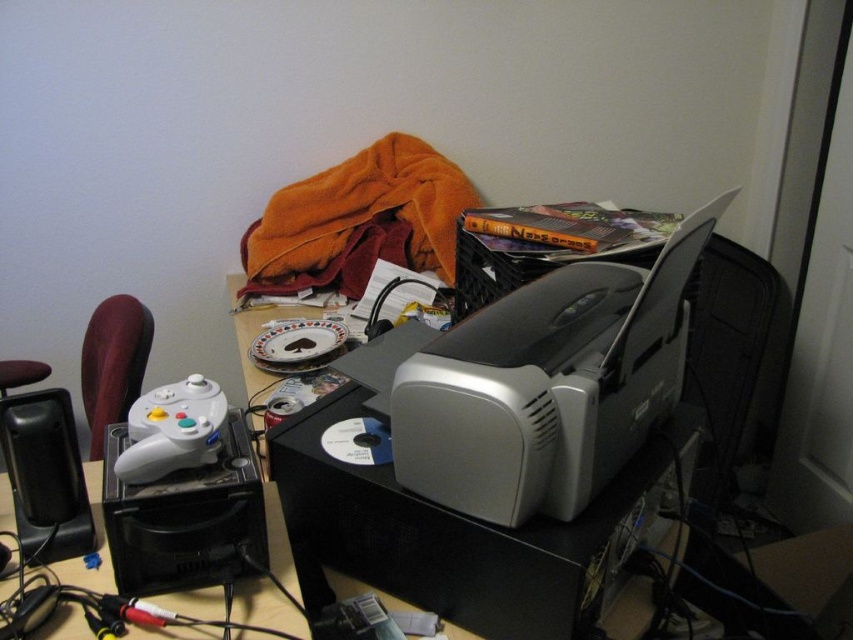
You are organizing the desk and need to move items to free up space. If you want to place a new item between the silver plastic printer at center and the black plastic speaker at lower left, where would you position it?

The silver plastic printer at center is above the black plastic speaker at lower left, so placing a new item between them would require positioning it in the space below the printer but above the speaker.